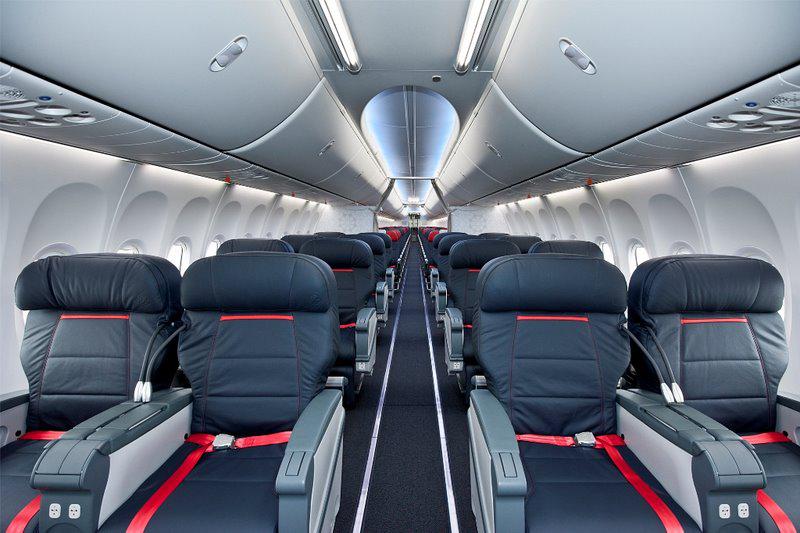
The height and width of the screenshot is (533, 800). I want to click on overhead bins, so click(265, 87), click(325, 124), click(369, 167), click(565, 99), click(498, 136), click(466, 169), click(434, 196), click(392, 195).